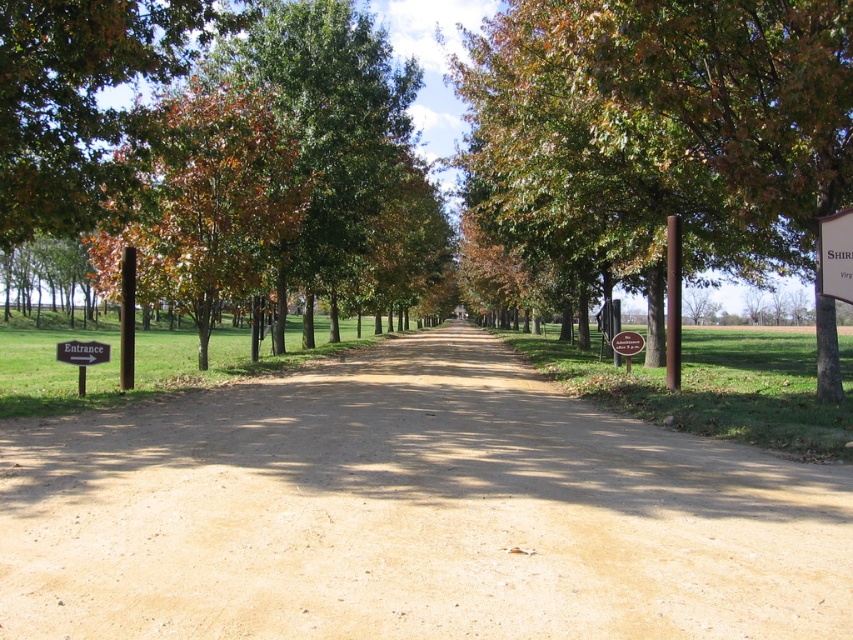
Question: Which point is closer to the camera?

Choices:
 (A) brown wooden sign at left
 (B) brown wooden sign at lower left
 (C) green leafy tree at center

Answer: (C)

Question: Which point is closer to the camera taking this photo?

Choices:
 (A) (102, 360)
 (B) (677, 67)
 (C) (224, 132)

Answer: (B)

Question: Is brown sandy dirt track at center thinner than brown wooden sign at lower left?

Choices:
 (A) yes
 (B) no

Answer: (B)

Question: Does brown sandy dirt track at center have a smaller size compared to green leafy tree at upper left?

Choices:
 (A) yes
 (B) no

Answer: (A)

Question: From the image, what is the correct spatial relationship of green leafy tree at center in relation to white plastic sign at upper right?

Choices:
 (A) left
 (B) right

Answer: (A)

Question: Which of the following is the closest to the observer?

Choices:
 (A) (775, 195)
 (B) (842, 250)

Answer: (B)